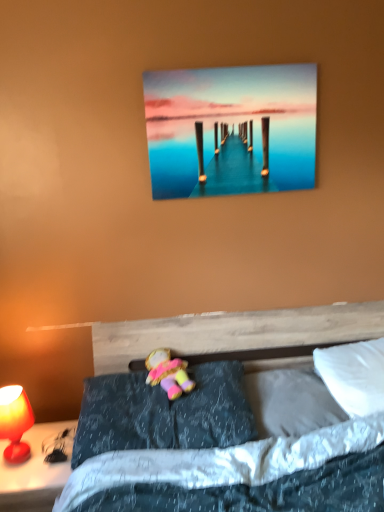
Where is `free point to the right of matte red lamp at left`? free point to the right of matte red lamp at left is located at coordinates (48, 471).